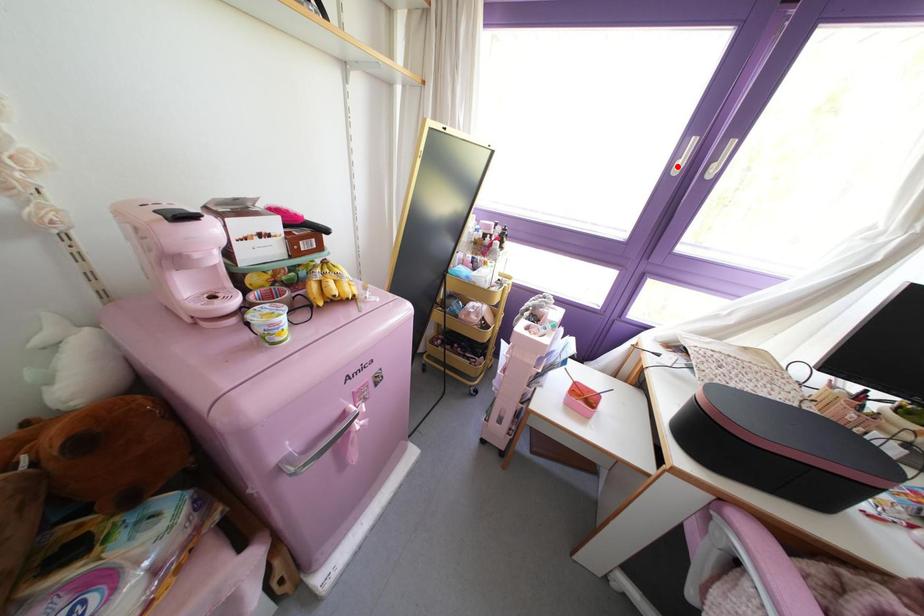
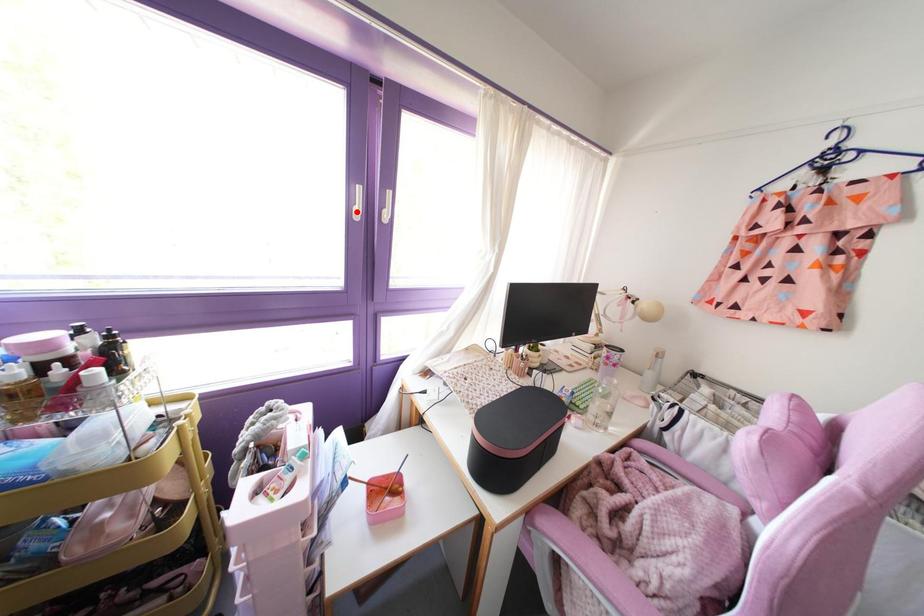
I am providing you with two images of the same scene from different viewpoints. A red point is marked on the first image and another point is marked on the second image. Are the points marked in image1 and image2 representing the same 3D position?

Yes